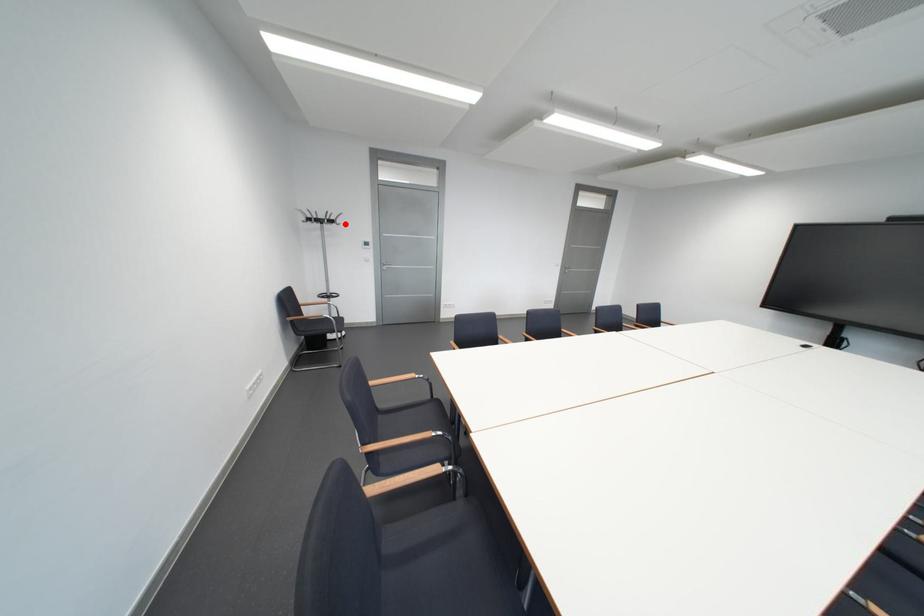
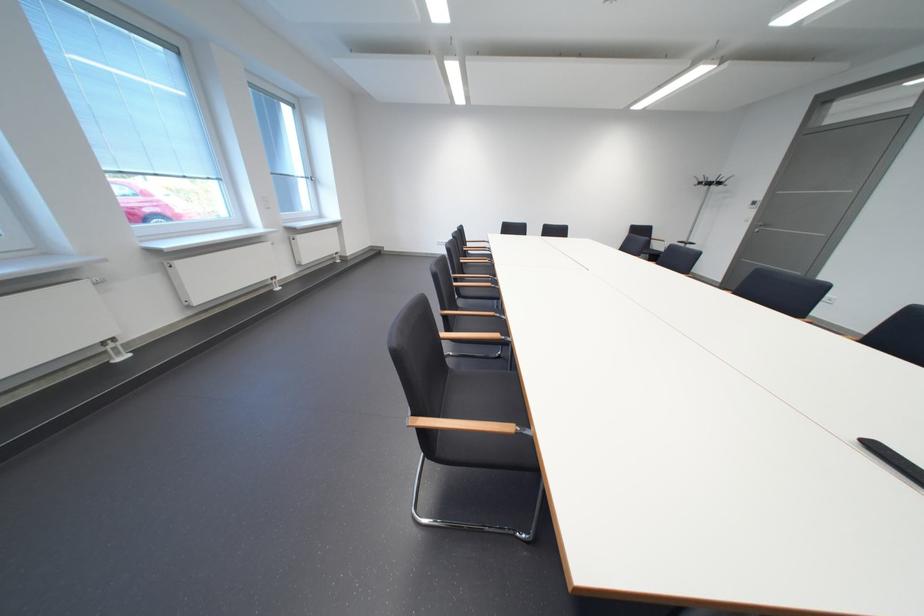
Question: I am providing you with two images of the same scene from different viewpoints. In image1, a red point is highlighted. Considering the same 3D point in image2, which of the following is correct?

Choices:
 (A) It is closer
 (B) It is farther

Answer: (B)